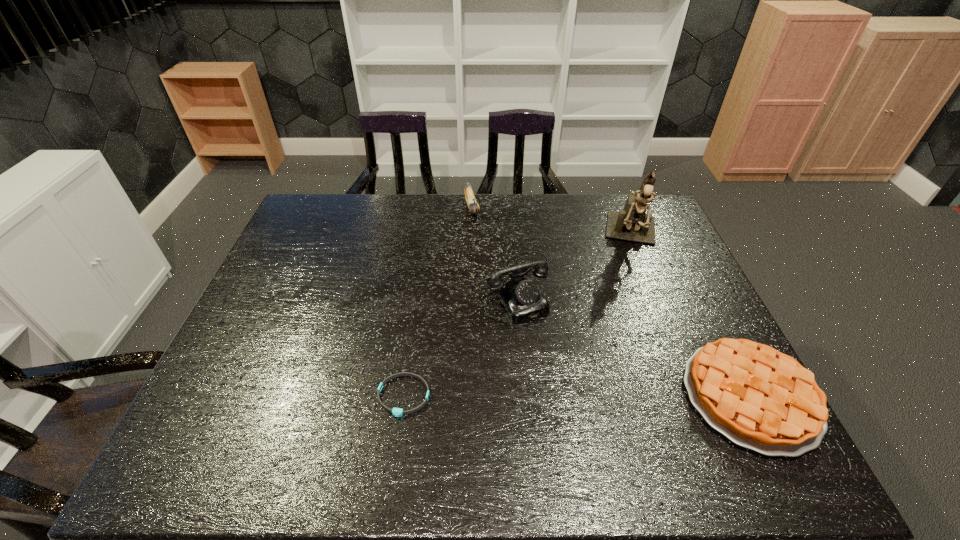
Where is `vacant space located on the front-facing side of the figurine`? vacant space located on the front-facing side of the figurine is located at coordinates (634, 305).

You are a GUI agent. You are given a task and a screenshot of the screen. Output one action in this format:
    pyautogui.click(x=<x>, y=<y>)
    Task: Click on the free space located 0.400m on the front-facing side of the figurine
    The width and height of the screenshot is (960, 540).
    Given the screenshot: What is the action you would take?
    pyautogui.click(x=633, y=361)

Locate an element on the screen. This screenshot has height=540, width=960. vacant space located 0.270m on the front-facing side of the figurine is located at coordinates (634, 323).

Where is `free space located at the stem of the banana`? free space located at the stem of the banana is located at coordinates pyautogui.click(x=491, y=286).

In order to click on blank area located at the stem of the banana in this screenshot , I will do click(489, 279).

Identify the location of vacant position located 0.200m at the stem of the banana. The height and width of the screenshot is (540, 960). (484, 260).

I want to click on figurine that is at the far edge, so click(632, 224).

This screenshot has height=540, width=960. I want to click on banana positioned at the far edge, so click(473, 206).

Locate an element on the screen. The image size is (960, 540). wristband located at the near edge is located at coordinates (397, 412).

Find the location of a particular element. pie present at the near edge is located at coordinates (759, 398).